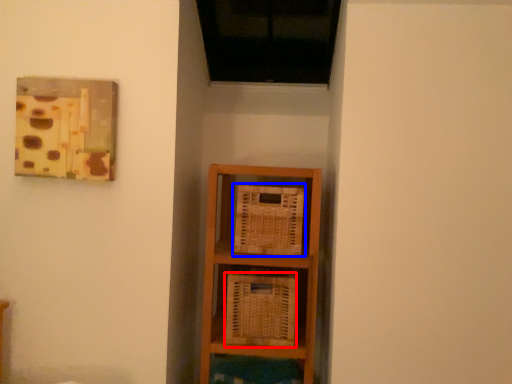
Question: Which object is closer to the camera taking this photo, basket (highlighted by a red box) or basket (highlighted by a blue box)?

Choices:
 (A) basket
 (B) basket

Answer: (A)